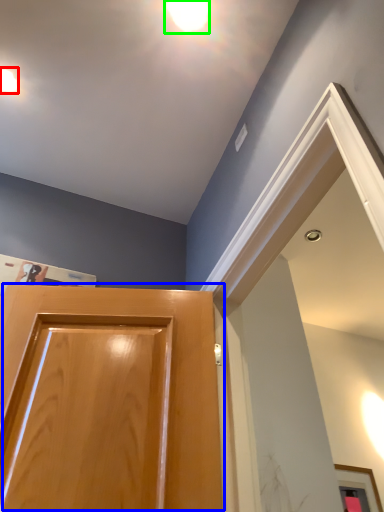
Question: Considering the real-world distances, which object is closest to droplight (highlighted by a red box)? door (highlighted by a blue box) or droplight (highlighted by a green box).

Choices:
 (A) door
 (B) droplight

Answer: (B)